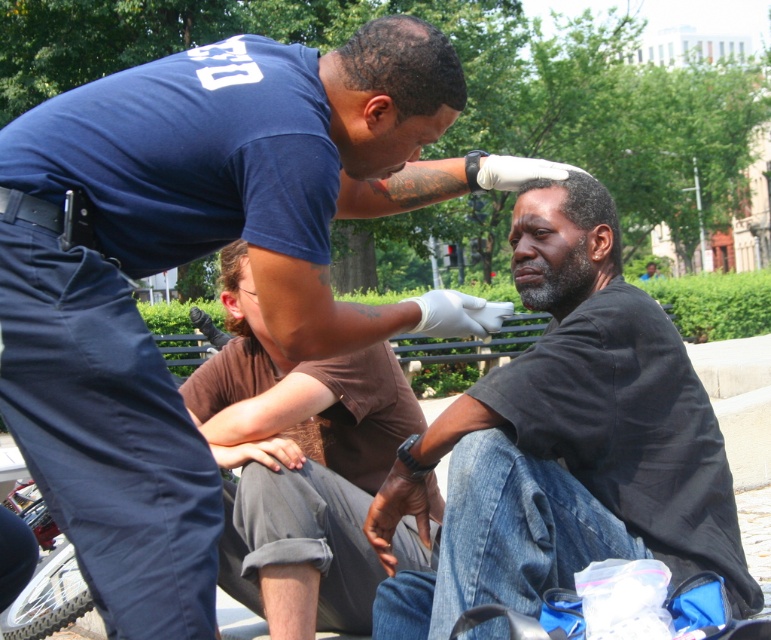
You are standing in the park and see two points marked in the image. Which point is nearer to you, point (295, 218) or point (520, 493)?

Point (295, 218) is closer to the viewer than point (520, 493).